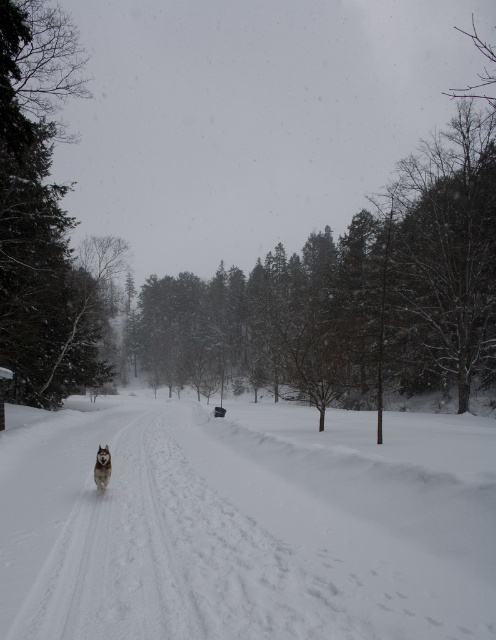
You are a photographer trying to capture a clear shot of the white fluffy dog at center. However, the white fluffy snow at center is obstructing your view. Can you determine if the dog is visible above the snow or hidden beneath it?

The white fluffy snow at center is taller than the white fluffy dog at center, so the dog is hidden beneath the snow.